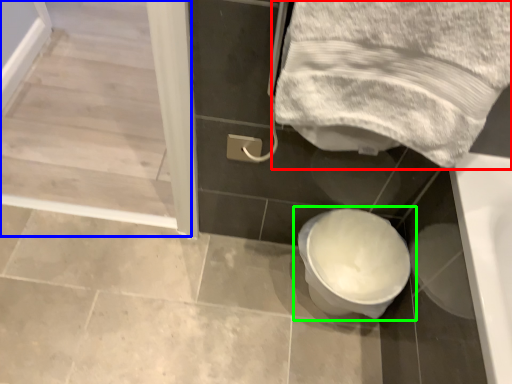
Question: Considering the real-world distances, which object is closest to towel (highlighted by a red box)? screen door (highlighted by a blue box) or toilet (highlighted by a green box).

Choices:
 (A) screen door
 (B) toilet

Answer: (B)